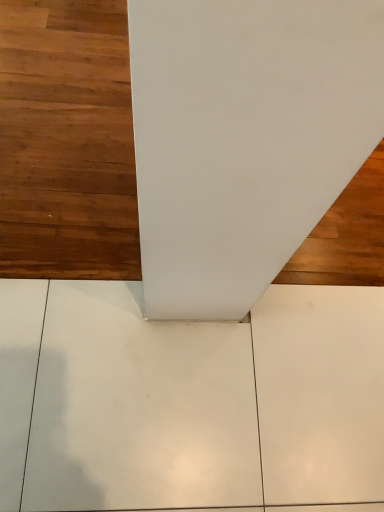
Question: Should I look upward or downward to see brown wood floor at upper left?

Choices:
 (A) down
 (B) up

Answer: (B)